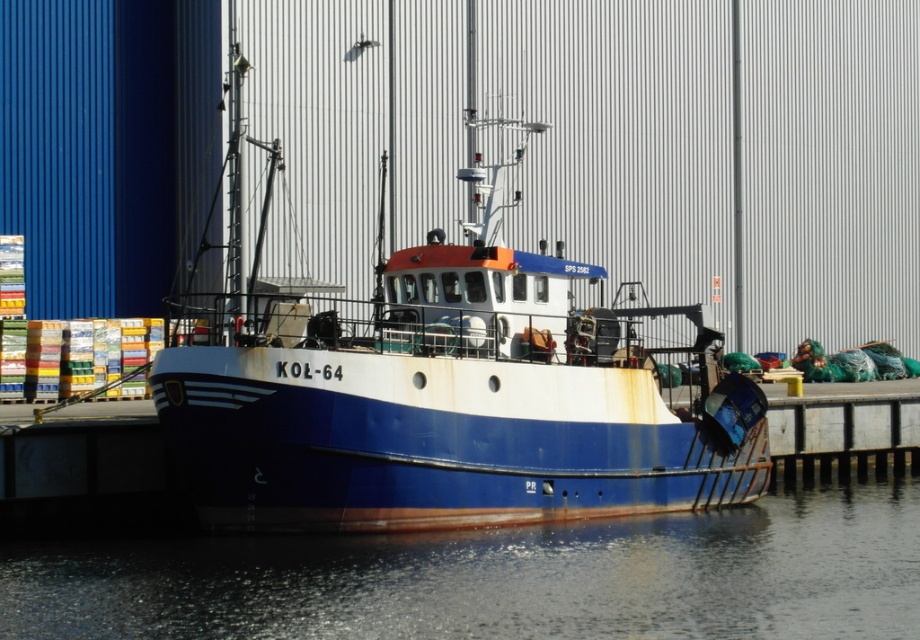
Question: Which of the following is the closest to the observer?

Choices:
 (A) (x=31, y=616)
 (B) (x=384, y=440)

Answer: (A)

Question: In this image, where is blue matte boat at center located relative to glossy water at lower center?

Choices:
 (A) right
 (B) left

Answer: (B)

Question: In this image, where is blue matte boat at center located relative to glossy water at lower center?

Choices:
 (A) above
 (B) below

Answer: (A)

Question: Which point is closer to the camera?

Choices:
 (A) glossy water at lower center
 (B) blue matte boat at center

Answer: (A)

Question: Is blue matte boat at center above glossy water at lower center?

Choices:
 (A) no
 (B) yes

Answer: (B)

Question: Which point is farther to the camera?

Choices:
 (A) (322, 337)
 (B) (659, 612)

Answer: (A)